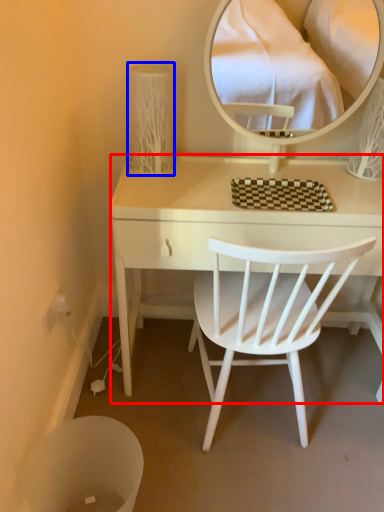
Question: Which of the following is the farthest to the observer, desk (highlighted by a red box) or table lamp (highlighted by a blue box)?

Choices:
 (A) desk
 (B) table lamp

Answer: (B)